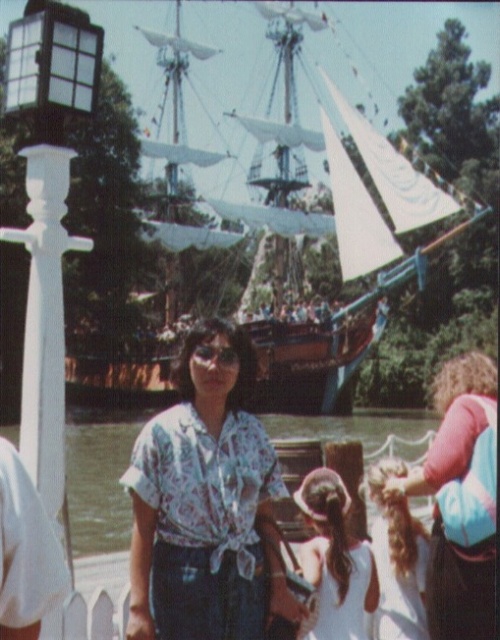
Consider the image. You are standing at point (328,468) and want to walk to the pirate ship docked near the water. Is the point (346,369) between you and the pirate ship?

Point (346,369) is behind point (328,468), so it is not between you and the pirate ship. Therefore, you can walk towards the pirate ship without the point (346,369) blocking your path.

You are standing in the theme park and want to take a photo of the wooden ship at center and curly hair at center together in the frame. Which direction should you move to ensure both are visible in your camera view?

The wooden ship at center is to the left of curly hair at center, so you should move to the right side of curly hair at center to include both in the frame.

You are taking a photo of the pirate ship and notice two points in the image labeled as point 1 and point 2. If point 1 is at coordinates point (x=211, y=232) and point 2 is at point (x=464, y=556), which point is closer to your camera lens?

Point 1 at coordinates point (x=211, y=232) is closer to the camera lens than point 2 at point (x=464, y=556) because it is further to the camera.